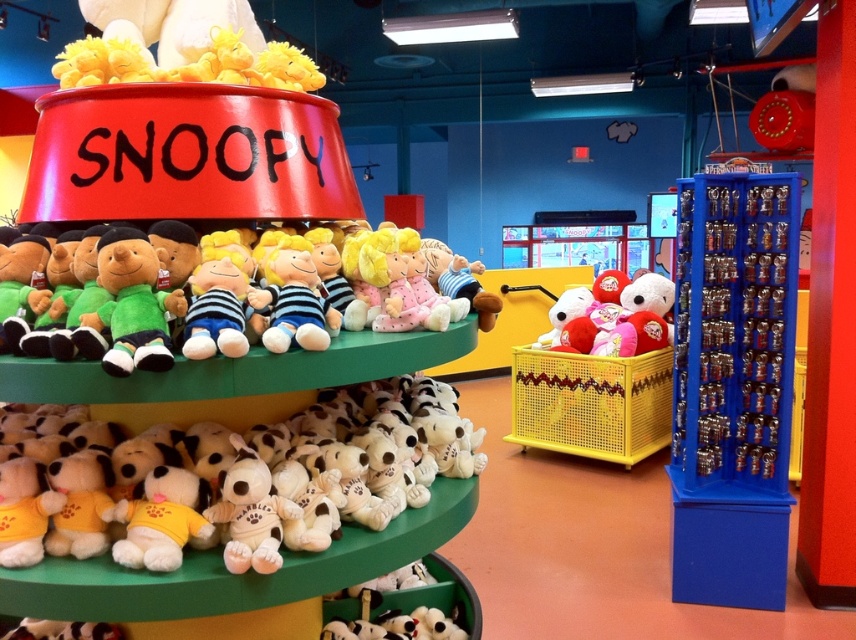
Question: Can you confirm if white plush dog at lower center is positioned above soft plush toys at center?

Choices:
 (A) yes
 (B) no

Answer: (B)

Question: Does blue plastic keychain rack at right have a larger size compared to striped fabric plush at center?

Choices:
 (A) yes
 (B) no

Answer: (A)

Question: Does soft plush toys at center come in front of striped fabric plush at center?

Choices:
 (A) yes
 (B) no

Answer: (A)

Question: Which of these objects is positioned closest to the soft plush toys at center?

Choices:
 (A) blue plastic keychain rack at right
 (B) white plush dog at lower center

Answer: (B)

Question: Which is nearer to the soft plush toys at center?

Choices:
 (A) white plush dog at lower center
 (B) striped fabric plush at center

Answer: (B)

Question: Which point is closer to the camera?

Choices:
 (A) white plush dog at lower center
 (B) blue plastic keychain rack at right
 (C) soft plush toys at center

Answer: (C)